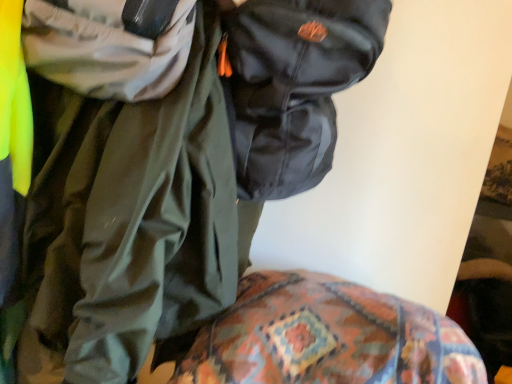
Question: Is patterned fabric at lower center to the left or to the right of shiny black jacket at upper center in the image?

Choices:
 (A) right
 (B) left

Answer: (A)

Question: Relative to shiny black jacket at upper center, is patterned fabric at lower center in front or behind?

Choices:
 (A) behind
 (B) front

Answer: (A)

Question: Estimate the real-world distances between objects in this image. Which object is closer to the glossy black backpack at upper center?

Choices:
 (A) patterned fabric at lower center
 (B) shiny black jacket at upper center

Answer: (B)

Question: Which is nearer to the patterned fabric at lower center?

Choices:
 (A) glossy black backpack at upper center
 (B) shiny black jacket at upper center

Answer: (B)